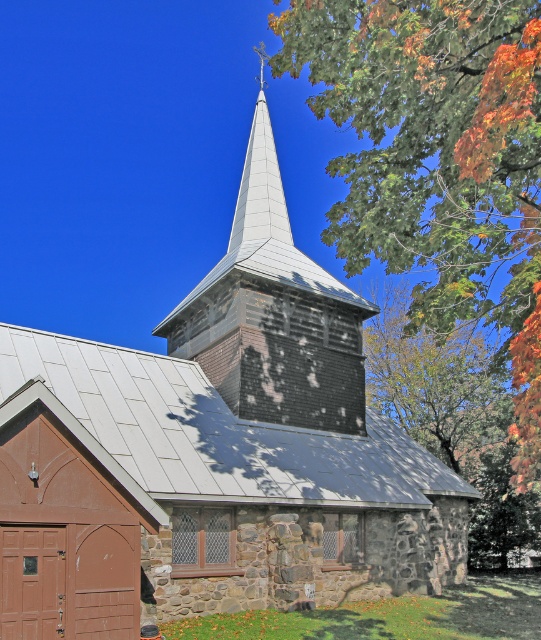
Question: Which point appears closest to the camera in this image?

Choices:
 (A) (359, 3)
 (B) (272, 195)

Answer: (A)

Question: Considering the relative positions of green leafy tree at upper right and white metallic spire at upper center in the image provided, where is green leafy tree at upper right located with respect to white metallic spire at upper center?

Choices:
 (A) below
 (B) above

Answer: (A)

Question: Which of the following is the closest to the observer?

Choices:
 (A) (457, 99)
 (B) (242, 355)
 (C) (286, 225)

Answer: (A)

Question: Considering the relative positions of green leafy tree at upper right and white metallic spire at upper center in the image provided, where is green leafy tree at upper right located with respect to white metallic spire at upper center?

Choices:
 (A) right
 (B) left

Answer: (A)

Question: Is green leafy tree at upper right closer to camera compared to white metallic spire at upper center?

Choices:
 (A) yes
 (B) no

Answer: (A)

Question: Estimate the real-world distances between objects in this image. Which object is farther from the green leafy tree at upper right?

Choices:
 (A) weathered wood steeple at center
 (B) white metallic spire at upper center

Answer: (B)